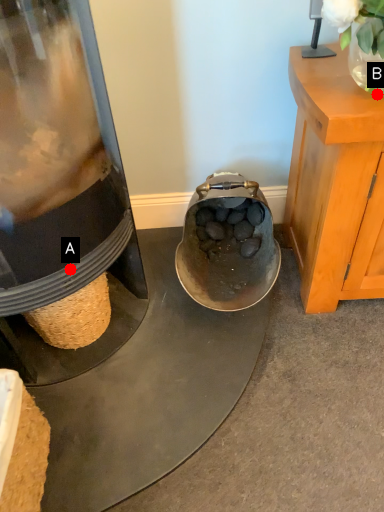
Question: Two points are circled on the image, labeled by A and B beside each circle. Which point is closer to the camera?

Choices:
 (A) A is closer
 (B) B is closer

Answer: (B)